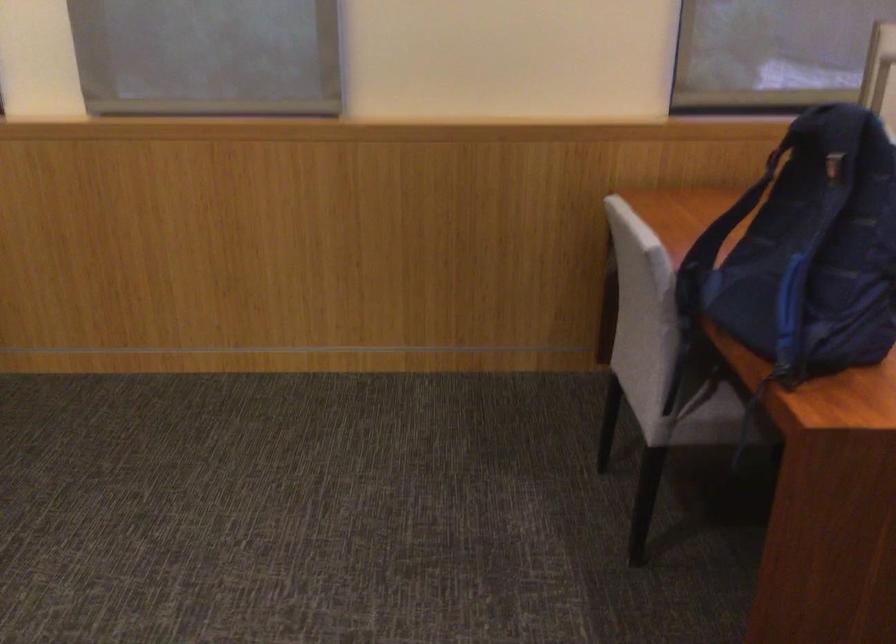
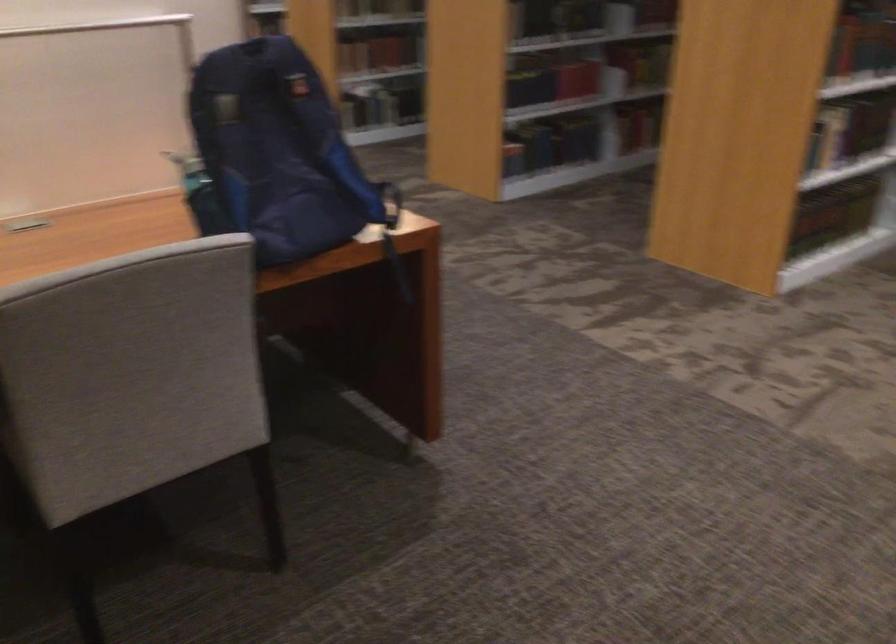
Locate, in the second image, the point that corresponds to point (806, 401) in the first image.

(392, 234)